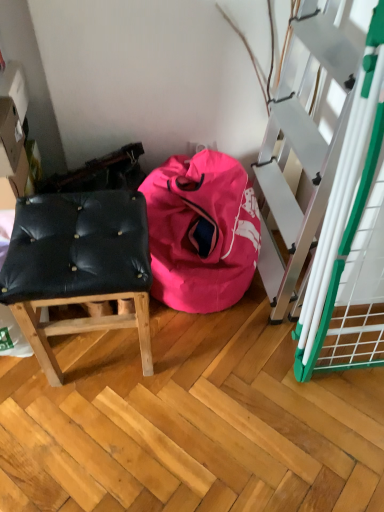
What is the approximate height of black leather stool at left?

The height of black leather stool at left is 50.03 centimeters.

This screenshot has height=512, width=384. Identify the location of black leather stool at left. (78, 265).

This screenshot has height=512, width=384. What do you see at coordinates (78, 265) in the screenshot?
I see `black leather stool at left` at bounding box center [78, 265].

What do you see at coordinates (201, 231) in the screenshot?
I see `pink fabric bean bag at center` at bounding box center [201, 231].

This screenshot has width=384, height=512. I want to click on pink fabric bean bag at center, so pyautogui.click(x=201, y=231).

Measure the distance between pink fabric bean bag at center and camera.

The distance of pink fabric bean bag at center from camera is 1.23 meters.

Where is `black leather stool at left`? black leather stool at left is located at coordinates click(78, 265).

Which is more to the left, pink fabric bean bag at center or black leather stool at left?

Positioned to the left is black leather stool at left.

Is pink fabric bean bag at center further to camera compared to black leather stool at left?

Yes, pink fabric bean bag at center is further from the viewer.

Which is closer, (x=219, y=276) or (x=137, y=247)?

Point (x=219, y=276).

From the image's perspective, which one is positioned higher, pink fabric bean bag at center or black leather stool at left?

pink fabric bean bag at center is shown above in the image.

From a real-world perspective, is pink fabric bean bag at center above or below black leather stool at left?

Clearly, from a real-world perspective, pink fabric bean bag at center is below black leather stool at left.

In terms of width, does pink fabric bean bag at center look wider or thinner when compared to black leather stool at left?

Considering their sizes, pink fabric bean bag at center looks broader than black leather stool at left.

Considering the relative sizes of pink fabric bean bag at center and black leather stool at left in the image provided, is pink fabric bean bag at center shorter than black leather stool at left?

Yes.

Considering the sizes of objects pink fabric bean bag at center and black leather stool at left in the image provided, who is smaller, pink fabric bean bag at center or black leather stool at left?

With smaller size is black leather stool at left.

Can we say pink fabric bean bag at center lies outside black leather stool at left?

Yes, pink fabric bean bag at center is located beyond the bounds of black leather stool at left.

Is pink fabric bean bag at center next to black leather stool at left?

pink fabric bean bag at center is not next to black leather stool at left, and they're not touching.

Is black leather stool at left at the back of pink fabric bean bag at center?

pink fabric bean bag at center does not have its back to black leather stool at left.

How far apart are pink fabric bean bag at center and black leather stool at left?

pink fabric bean bag at center and black leather stool at left are 10.68 inches apart from each other.

You are a GUI agent. You are given a task and a screenshot of the screen. Output one action in this format:
    pyautogui.click(x=<x>, y=<y>)
    Task: Click on the furniture that appears on the left of pink fabric bean bag at center
    This screenshot has height=512, width=384.
    Given the screenshot: What is the action you would take?
    pyautogui.click(x=78, y=265)

Is black leather stool at left at the left side of pink fabric bean bag at center?

Correct, you'll find black leather stool at left to the left of pink fabric bean bag at center.

Is the depth of black leather stool at left greater than that of pink fabric bean bag at center?

No.

Considering the points (104, 270) and (215, 154), which point is in front, point (104, 270) or point (215, 154)?

The point (104, 270) is closer to the camera.

From the image's perspective, between black leather stool at left and pink fabric bean bag at center, which one is located above?

pink fabric bean bag at center, from the image's perspective.

From a real-world perspective, between black leather stool at left and pink fabric bean bag at center, who is vertically higher?

From a 3D spatial view, black leather stool at left is above.

Which object is wider, black leather stool at left or pink fabric bean bag at center?

With larger width is pink fabric bean bag at center.

Which of these two, black leather stool at left or pink fabric bean bag at center, stands taller?

black leather stool at left is taller.

Considering the sizes of objects black leather stool at left and pink fabric bean bag at center in the image provided, who is bigger, black leather stool at left or pink fabric bean bag at center?

With larger size is pink fabric bean bag at center.

Is pink fabric bean bag at center inside black leather stool at left?

No, pink fabric bean bag at center is located outside of black leather stool at left.

Is the surface of black leather stool at left in direct contact with pink fabric bean bag at center?

black leather stool at left and pink fabric bean bag at center are clearly separated.

Does black leather stool at left turn towards pink fabric bean bag at center?

No, black leather stool at left is not facing towards pink fabric bean bag at center.

Can you tell me how much black leather stool at left and pink fabric bean bag at center differ in facing direction?

0.271 degrees separate the facing orientations of black leather stool at left and pink fabric bean bag at center.

The height and width of the screenshot is (512, 384). In order to click on bean bag chair below the black leather stool at left (from a real-world perspective) in this screenshot , I will do `click(201, 231)`.

The width and height of the screenshot is (384, 512). I want to click on bean bag chair located on the right of black leather stool at left, so click(201, 231).

This screenshot has height=512, width=384. I want to click on bean bag chair that appears behind the black leather stool at left, so click(x=201, y=231).